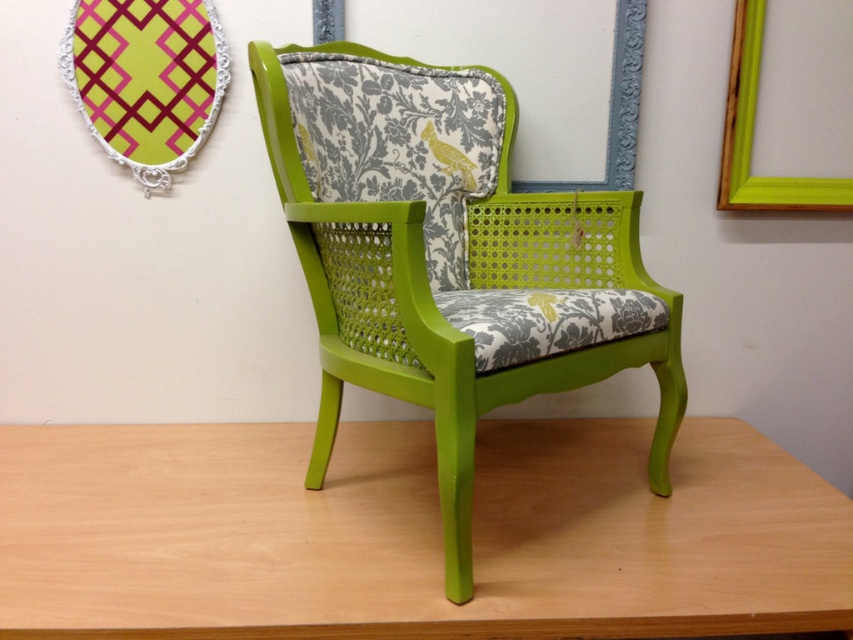
Is wooden table at center shorter than lime green cane armchair at center?

Yes, wooden table at center is shorter than lime green cane armchair at center.

Who is positioned more to the left, wooden table at center or lime green cane armchair at center?

Positioned to the left is wooden table at center.

Is point (560, 525) farther from camera compared to point (463, 188)?

No.

The height and width of the screenshot is (640, 853). I want to click on wooden table at center, so click(412, 532).

Is matte plastic picture frame at upper left behind green matte picture frame at upper right?

No, it is in front of green matte picture frame at upper right.

Does matte plastic picture frame at upper left have a larger size compared to green matte picture frame at upper right?

Actually, matte plastic picture frame at upper left might be smaller than green matte picture frame at upper right.

Where is `matte plastic picture frame at upper left`? The height and width of the screenshot is (640, 853). matte plastic picture frame at upper left is located at coordinates (146, 80).

Locate an element on the screen. The image size is (853, 640). lime green cane armchair at center is located at coordinates (450, 259).

Is lime green cane armchair at center to the left of matte plastic picture frame at upper left from the viewer's perspective?

No, lime green cane armchair at center is not to the left of matte plastic picture frame at upper left.

Between point (431, 208) and point (126, 74), which one is positioned behind?

Positioned behind is point (126, 74).

At what (x,y) coordinates should I click in order to perform the action: click on lime green cane armchair at center. Please return your answer as a coordinate pair (x, y). The height and width of the screenshot is (640, 853). Looking at the image, I should click on (450, 259).